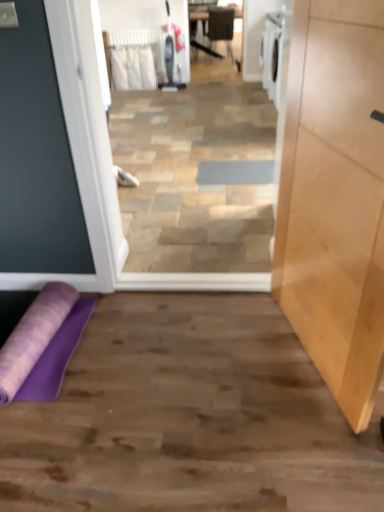
In order to click on blank area beneath light wood cabinet at right (from a real-world perspective) in this screenshot , I will do `click(299, 355)`.